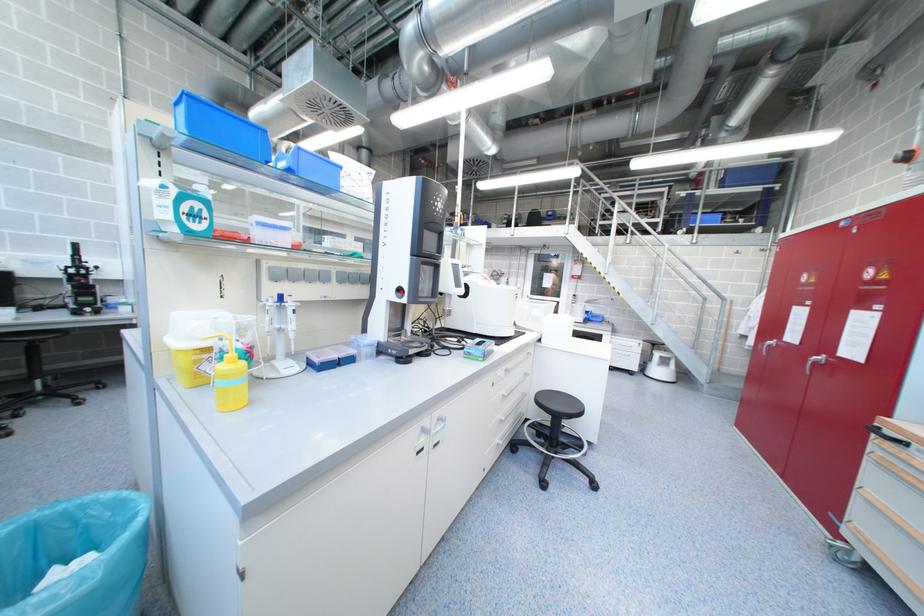
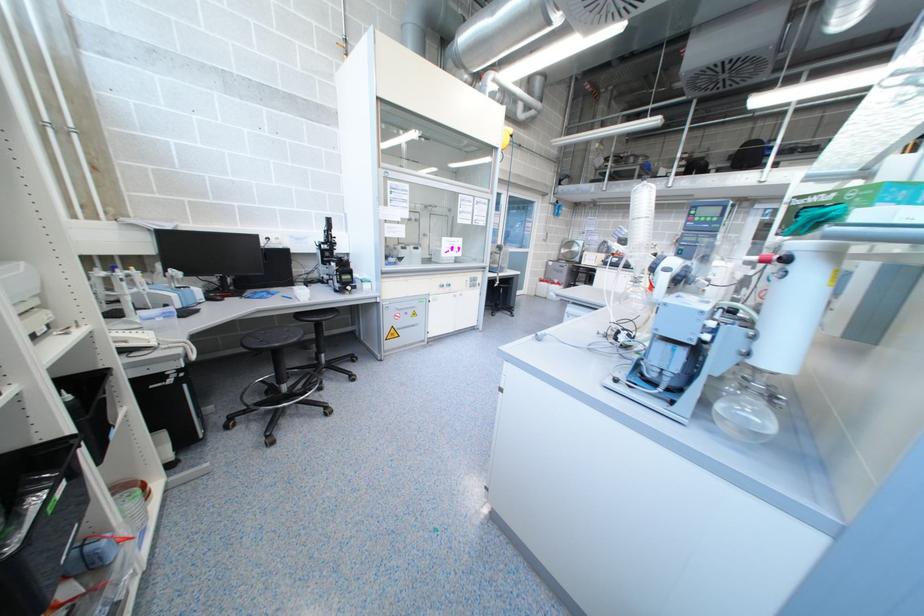
Question: In a continuous first-person perspective shot, in which direction is the camera moving?

Choices:
 (A) Left
 (B) Right
 (C) Forward
 (D) Backward

Answer: (A)